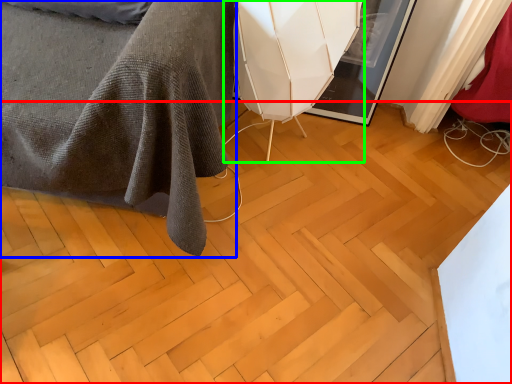
Question: Which object is the farthest from plywood (highlighted by a red box)? Choose among these: furniture (highlighted by a blue box) or swivel chair (highlighted by a green box).

Choices:
 (A) furniture
 (B) swivel chair

Answer: (B)